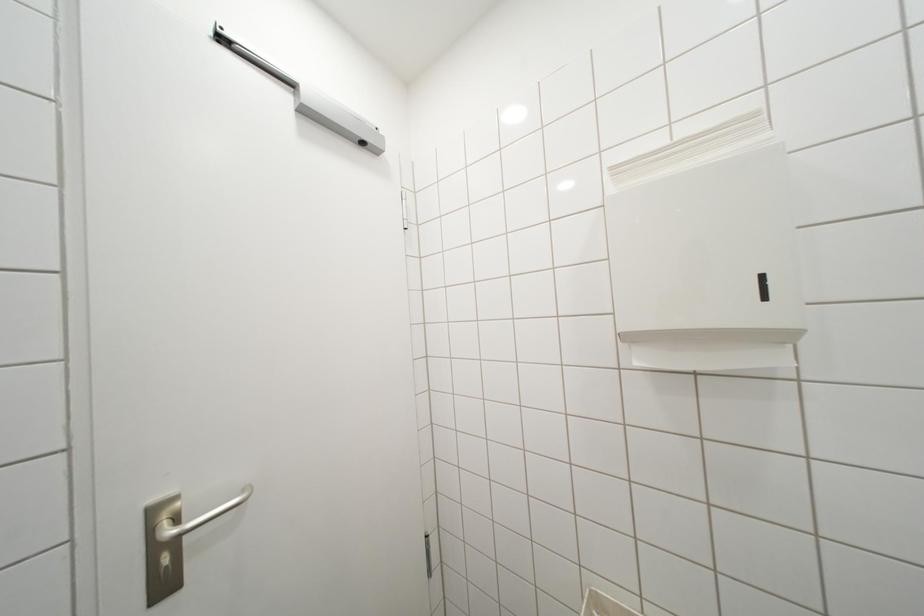
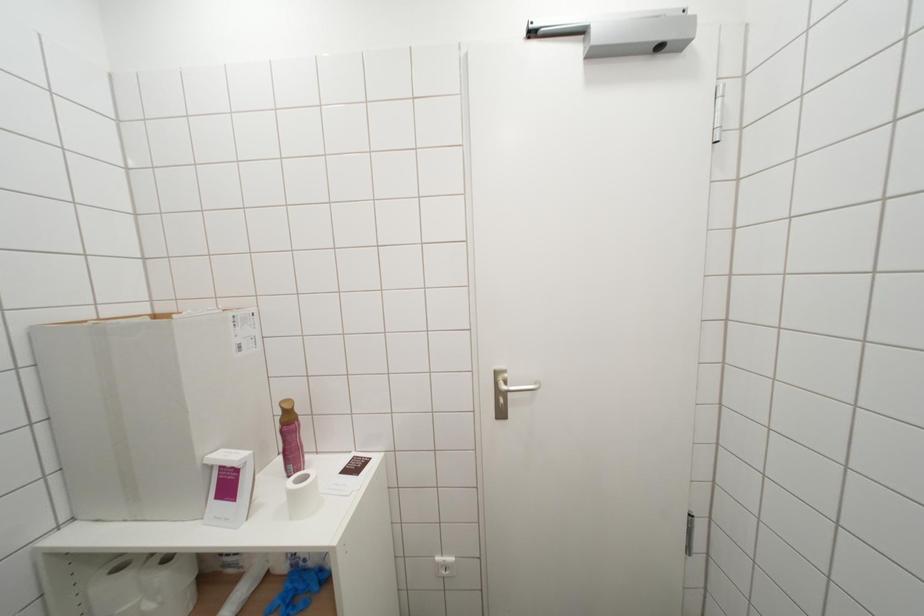
Question: The first image is from the beginning of the video and the second image is from the end. How did the camera likely rotate when shooting the video?

Choices:
 (A) Left
 (B) Right
 (C) Up
 (D) Down

Answer: (A)